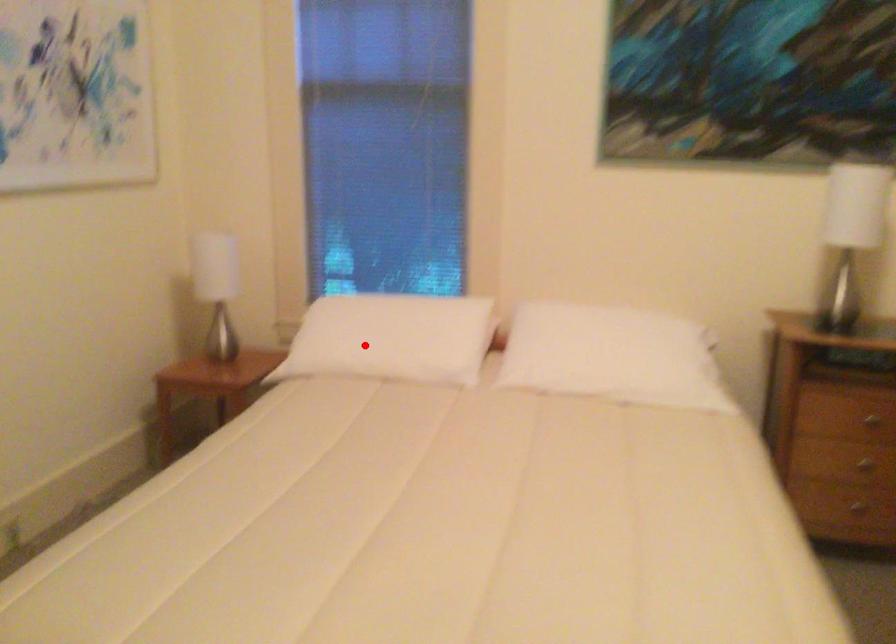
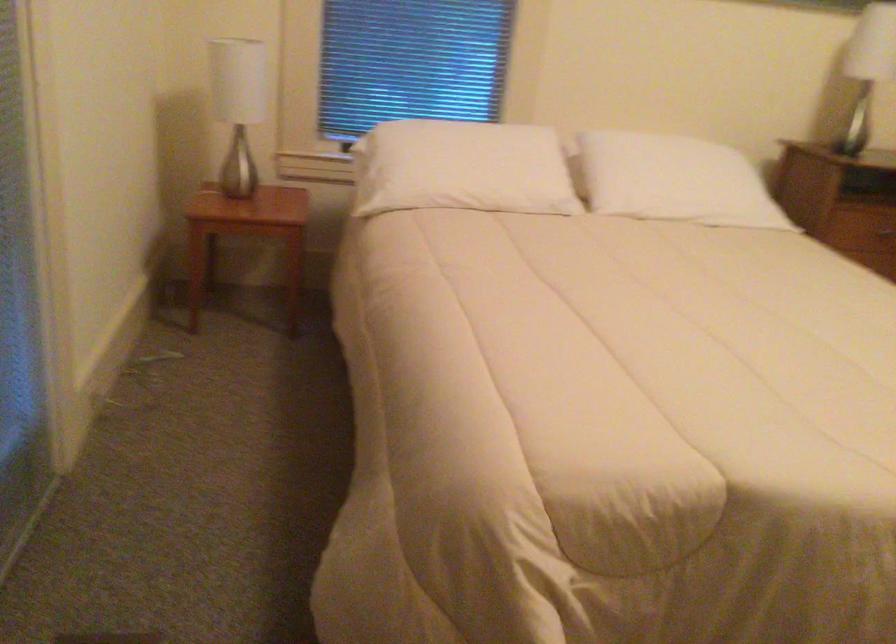
In the second image, find the point that corresponds to the highlighted location in the first image.

(462, 167)